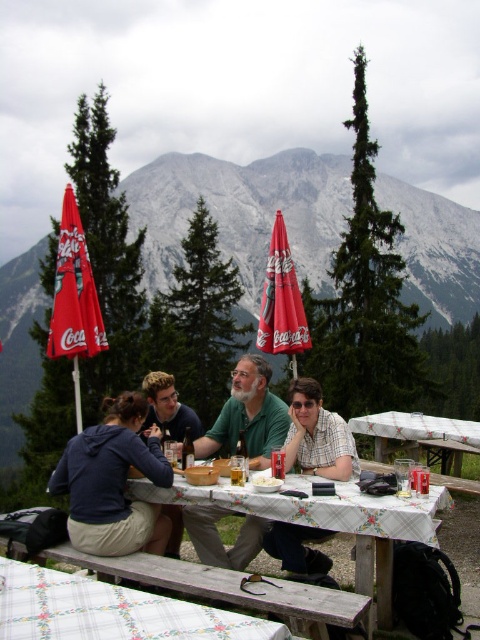
Which of these two, dark blue hoodie at lower left or checkered fabric shirt at center, stands taller?

With more height is checkered fabric shirt at center.

Measure the distance between dark blue hoodie at lower left and camera.

dark blue hoodie at lower left is 23.71 meters from camera.

You are a GUI agent. You are given a task and a screenshot of the screen. Output one action in this format:
    pyautogui.click(x=<x>, y=<y>)
    Task: Click on the dark blue hoodie at lower left
    
    Given the screenshot: What is the action you would take?
    pyautogui.click(x=117, y=484)

Where is `dark blue shirt at center`? This screenshot has width=480, height=640. dark blue shirt at center is located at coordinates (167, 410).

Who is more distant from viewer, (191, 420) or (276, 467)?

The point (191, 420) is behind.

This screenshot has width=480, height=640. What are the coordinates of `dark blue shirt at center` in the screenshot? It's located at (167, 410).

Can you confirm if dark blue hoodie at lower left is taller than translucent glass cup at table center?

Yes.

Is dark blue hoodie at lower left further to the viewer compared to translucent glass cup at table center?

That is False.

Where is `dark blue hoodie at lower left`? Image resolution: width=480 pixels, height=640 pixels. dark blue hoodie at lower left is located at coordinates (117, 484).